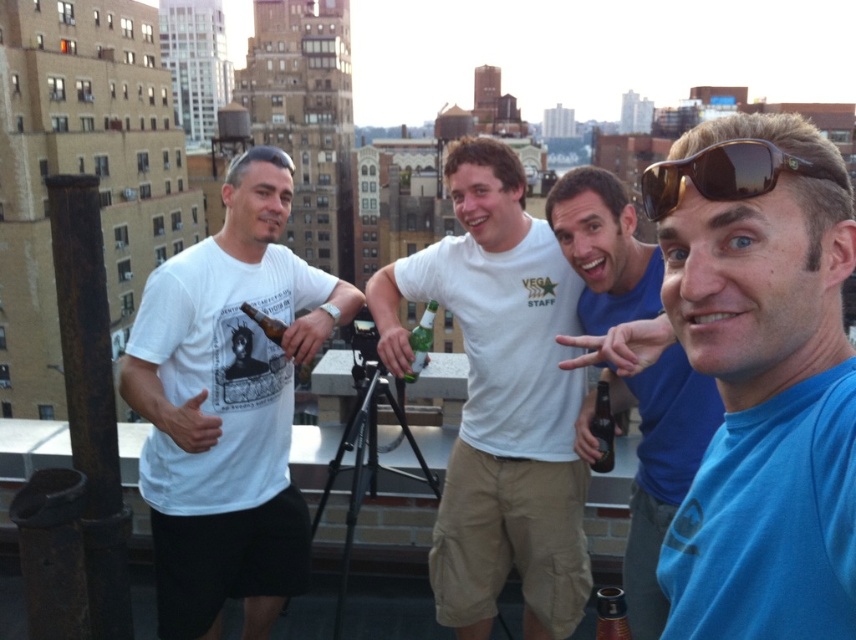
Question: Which point is closer to the camera?

Choices:
 (A) 414,356
 (B) 509,497

Answer: (B)

Question: Is blue matte shirt at center bigger than brown reflective sunglasses at upper right?

Choices:
 (A) no
 (B) yes

Answer: (B)

Question: Can you confirm if blue fabric shirt at right is wider than brown reflective sunglasses at upper right?

Choices:
 (A) no
 (B) yes

Answer: (B)

Question: Which object appears farthest from the camera in this image?

Choices:
 (A) white matte t-shirt at left
 (B) brown reflective sunglasses at upper right

Answer: (A)

Question: Estimate the real-world distances between objects in this image. Which object is closer to the blue fabric shirt at right?

Choices:
 (A) green glass bottle at center
 (B) blue matte shirt at center

Answer: (B)

Question: Is blue fabric shirt at right positioned at the back of brown glass bottle at center?

Choices:
 (A) no
 (B) yes

Answer: (A)